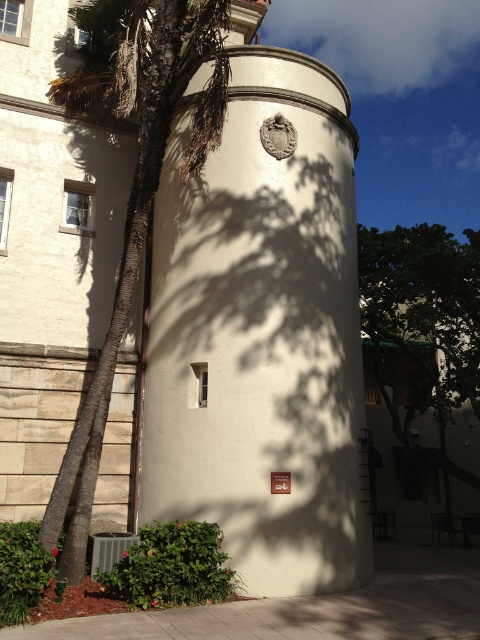
Question: Which is nearer to the green leafy palm tree at left?

Choices:
 (A) green leafy tree at center
 (B) white smooth bell tower at center

Answer: (B)

Question: Is white smooth bell tower at center smaller than green leafy tree at center?

Choices:
 (A) yes
 (B) no

Answer: (A)

Question: Is white smooth bell tower at center below green leafy palm tree at left?

Choices:
 (A) no
 (B) yes

Answer: (B)

Question: Is white smooth bell tower at center further to camera compared to green leafy palm tree at left?

Choices:
 (A) no
 (B) yes

Answer: (B)

Question: Which object appears closest to the camera in this image?

Choices:
 (A) white smooth bell tower at center
 (B) green leafy tree at center
 (C) green leafy palm tree at left

Answer: (C)

Question: Which point appears farthest from the camera in this image?

Choices:
 (A) (304, 86)
 (B) (411, 228)

Answer: (B)